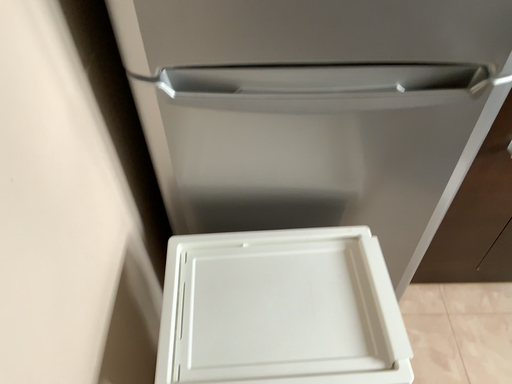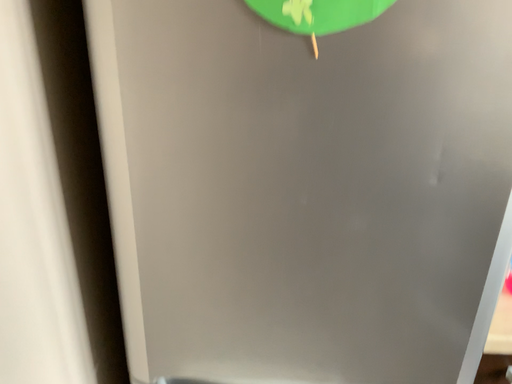
Question: Which way did the camera rotate in the video?

Choices:
 (A) rotated upward
 (B) rotated downward

Answer: (A)